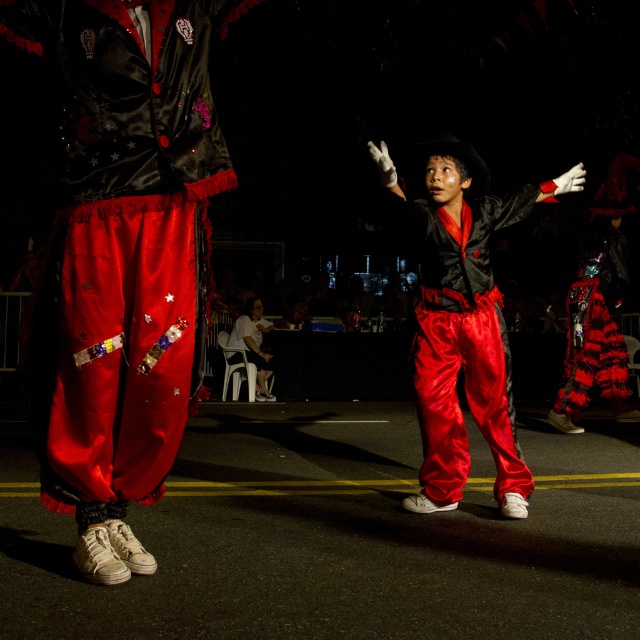
Does shiny satin pants at center have a lesser width compared to satin red pants at center?

Incorrect, shiny satin pants at center's width is not less than satin red pants at center's.

The width and height of the screenshot is (640, 640). In order to click on shiny satin pants at center in this screenshot , I will do `click(124, 243)`.

The width and height of the screenshot is (640, 640). In order to click on shiny satin pants at center in this screenshot , I will do `click(124, 243)`.

Does shiny satin pants at center come behind white satin pants at center?

No.

Where is `shiny satin pants at center`? shiny satin pants at center is located at coordinates (124, 243).

Which is more to the right, satin red pants at center or velvet-like red cape at center?

Positioned to the right is velvet-like red cape at center.

Image resolution: width=640 pixels, height=640 pixels. What are the coordinates of `satin red pants at center` in the screenshot? It's located at (464, 346).

You are a GUI agent. You are given a task and a screenshot of the screen. Output one action in this format:
    pyautogui.click(x=<x>, y=<y>)
    Task: Click on the satin red pants at center
    The image size is (640, 640).
    Given the screenshot: What is the action you would take?
    464,346

Where is `satin red pants at center`? The image size is (640, 640). satin red pants at center is located at coordinates (464, 346).